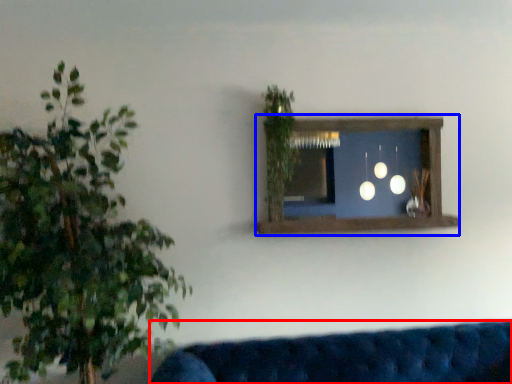
Question: Which object is closer to the camera taking this photo, studio couch (highlighted by a red box) or window frame (highlighted by a blue box)?

Choices:
 (A) studio couch
 (B) window frame

Answer: (A)